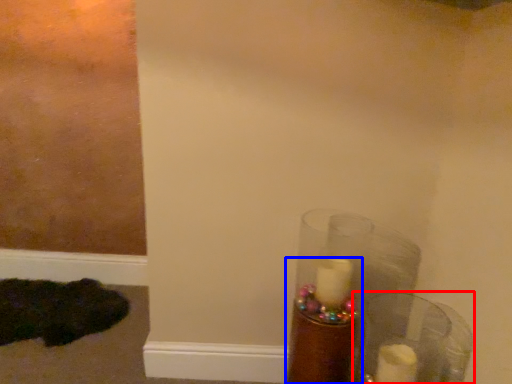
Question: Which of the following is the farthest to the observer, glass vase (highlighted by a red box) or candle holder (highlighted by a blue box)?

Choices:
 (A) glass vase
 (B) candle holder

Answer: (B)